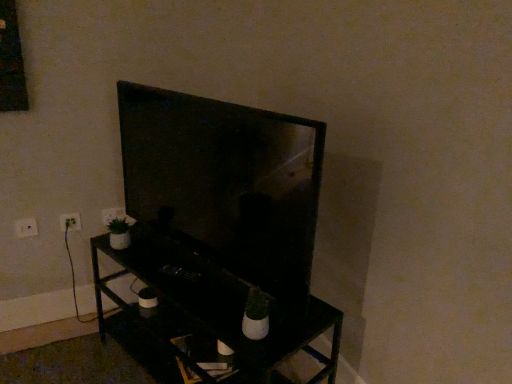
The image size is (512, 384). In order to click on white plastic electric outlet at left, positioned as the second electric outlet in right-to-left order in this screenshot , I will do click(70, 221).

What do you see at coordinates (70, 221) in the screenshot? I see `white plastic electric outlet at left, the 2th electric outlet positioned from the back` at bounding box center [70, 221].

Looking at this image, measure the distance between black matte tv stand at center and camera.

black matte tv stand at center is 1.15 meters from camera.

What is the approximate height of white plastic electric outlet at lower left, the 3th electric outlet positioned from the front?

The height of white plastic electric outlet at lower left, the 3th electric outlet positioned from the front, is 3.59 inches.

This screenshot has height=384, width=512. In order to click on white plastic electric outlet at left, which is the second electric outlet from front to back in this screenshot , I will do `click(70, 221)`.

From a real-world perspective, between matte black tv at center and black matte tv stand at center, who is vertically higher?

matte black tv at center.

At what (x,y) coordinates should I click in order to perform the action: click on furniture beneath the matte black tv at center (from a real-world perspective). Please return your answer as a coordinate pair (x, y). The width and height of the screenshot is (512, 384). Looking at the image, I should click on (204, 313).

Which of these two, matte black tv at center or black matte tv stand at center, is smaller?

matte black tv at center.

Is matte black tv at center in contact with black matte tv stand at center?

matte black tv at center and black matte tv stand at center are clearly separated.

From a real-world perspective, between matte black tv at center and white plastic electric outlet at left, positioned as the 2th electric outlet in left-to-right order, who is vertically lower?

white plastic electric outlet at left, positioned as the 2th electric outlet in left-to-right order, is physically lower.

Is matte black tv at center placed right next to white plastic electric outlet at left, the 2th electric outlet positioned from the back?

No, matte black tv at center is not next to white plastic electric outlet at left, the 2th electric outlet positioned from the back.

Considering the sizes of objects matte black tv at center and white plastic electric outlet at left, positioned as the 2th electric outlet in left-to-right order, in the image provided, who is wider, matte black tv at center or white plastic electric outlet at left, positioned as the 2th electric outlet in left-to-right order,?

Wider between the two is matte black tv at center.

Does point (253, 146) lie in front of point (76, 217)?

That is True.

Considering their positions, is white plastic electric outlet at lower left, the third electric outlet when ordered from left to right, located in front of or behind white plastic electric outlet at left, which is the second electric outlet from front to back?

Clearly, white plastic electric outlet at lower left, the third electric outlet when ordered from left to right, is behind white plastic electric outlet at left, which is the second electric outlet from front to back.

Based on the photo, are white plastic electric outlet at lower left, the 3th electric outlet positioned from the front, and white plastic electric outlet at left, the 2th electric outlet positioned from the back, making contact?

No, white plastic electric outlet at lower left, the 3th electric outlet positioned from the front, is not touching white plastic electric outlet at left, the 2th electric outlet positioned from the back.

From a real-world perspective, between white plastic electric outlet at lower left, which ranks as the first electric outlet in right-to-left order, and white plastic electric outlet at left, the 2th electric outlet positioned from the back, who is vertically higher?

white plastic electric outlet at lower left, which ranks as the first electric outlet in right-to-left order.

Does white plastic electric outlet at lower left, marked as the first electric outlet in a back-to-front arrangement, have a lesser height compared to white plastic electric outlet at left, which is the second electric outlet from front to back?

No.

Which object is positioned more to the left, black matte tv stand at center or white plastic electric outlet at left, positioned as the 2th electric outlet in left-to-right order?

Positioned to the left is white plastic electric outlet at left, positioned as the 2th electric outlet in left-to-right order.

Which of these two, black matte tv stand at center or white plastic electric outlet at left, the 2th electric outlet positioned from the back, is wider?

Wider between the two is black matte tv stand at center.

From a real-world perspective, which object rests below the other?

In real-world perspective, black matte tv stand at center is lower.

Does black matte tv stand at center have a greater height compared to white plastic electric outlet at left, the 2th electric outlet positioned from the back?

Yes.

From the picture: Between white plastic electric outlet at left, which is the second electric outlet from front to back, and black matte tv stand at center, which one has larger width?

Wider between the two is black matte tv stand at center.

Is the position of white plastic electric outlet at left, which is the second electric outlet from front to back, more distant than that of black matte tv stand at center?

Yes, it is.

Is black matte tv stand at center completely or partially inside white plastic electric outlet at left, positioned as the 2th electric outlet in left-to-right order?

No, black matte tv stand at center is not a part of white plastic electric outlet at left, positioned as the 2th electric outlet in left-to-right order.

From a real-world perspective, who is located lower, white plastic electric outlet at left, which is the second electric outlet from front to back, or black matte tv stand at center?

black matte tv stand at center.

From a real-world perspective, is black matte tv stand at center on white plastic electric outlet at lower left, which ranks as the first electric outlet in right-to-left order?

Incorrect, from a real-world perspective, black matte tv stand at center is lower than white plastic electric outlet at lower left, which ranks as the first electric outlet in right-to-left order.

Locate an element on the screen. furniture on the right of white plastic electric outlet at lower left, which ranks as the first electric outlet in right-to-left order is located at coordinates (204, 313).

Which of these two, black matte tv stand at center or white plastic electric outlet at lower left, which ranks as the first electric outlet in right-to-left order, stands shorter?

With less height is white plastic electric outlet at lower left, which ranks as the first electric outlet in right-to-left order.

Is black matte tv stand at center facing towards white plastic electric outlet at lower left, the 3th electric outlet from the right?

No, black matte tv stand at center is not oriented towards white plastic electric outlet at lower left, the 3th electric outlet from the right.

Which is behind, point (216, 275) or point (27, 224)?

The point (27, 224) is farther.

Are black matte tv stand at center and white plastic electric outlet at lower left, the 3th electric outlet from the right, located far from each other?

No, black matte tv stand at center is not far from white plastic electric outlet at lower left, the 3th electric outlet from the right.

Locate an element on the screen. furniture behind the matte black tv at center is located at coordinates (204, 313).

From the image's perspective, which electric outlet is the 2nd one below the matte black tv at center? Please provide its 2D coordinates.

[(70, 221)]

Based on their spatial positions, is white plastic electric outlet at lower left, which is counted as the first electric outlet, starting from the left, or matte black tv at center closer to black matte tv stand at center?

The object closer to black matte tv stand at center is matte black tv at center.

When comparing their distances from matte black tv at center, does white plastic electric outlet at lower left, marked as the first electric outlet in a back-to-front arrangement, or black matte tv stand at center seem further?

white plastic electric outlet at lower left, marked as the first electric outlet in a back-to-front arrangement, lies further to matte black tv at center than the other object.

When comparing their distances from white plastic electric outlet at left, positioned as the 2th electric outlet in left-to-right order, does matte black tv at center or white plastic electric outlet at lower left, marked as the first electric outlet in a back-to-front arrangement, seem closer?

white plastic electric outlet at lower left, marked as the first electric outlet in a back-to-front arrangement, lies closer to white plastic electric outlet at left, positioned as the 2th electric outlet in left-to-right order, than the other object.

From the image, which object appears to be farther from matte black tv at center, white plastic electric outlet at left, which is the second electric outlet from front to back, or white plastic electric outlet at lower left, the 3th electric outlet from the right?

white plastic electric outlet at lower left, the 3th electric outlet from the right, is positioned further to the anchor matte black tv at center.

Based on their spatial positions, is white plastic electric outlet at lower left, which ranks as the first electric outlet in right-to-left order, or white plastic electric outlet at left, positioned as the second electric outlet in right-to-left order, closer to matte black tv at center?

Based on the image, white plastic electric outlet at lower left, which ranks as the first electric outlet in right-to-left order, appears to be nearer to matte black tv at center.

Based on their spatial positions, is white plastic electric outlet at lower left, the 3th electric outlet from the right, or black matte tv stand at center closer to matte black tv at center?

black matte tv stand at center lies closer to matte black tv at center than the other object.

Which object lies further to the anchor point black matte tv stand at center, matte black tv at center or white plastic electric outlet at lower left, marked as the first electric outlet in a back-to-front arrangement?

The object further to black matte tv stand at center is white plastic electric outlet at lower left, marked as the first electric outlet in a back-to-front arrangement.

From the picture: When comparing their distances from white plastic electric outlet at lower left, the 3th electric outlet from the right, does white plastic electric outlet at lower left, which ranks as the first electric outlet in right-to-left order, or black matte tv stand at center seem further?

Among the two, black matte tv stand at center is located further to white plastic electric outlet at lower left, the 3th electric outlet from the right.

I want to click on furniture located between matte black tv at center and white plastic electric outlet at left, positioned as the 2th electric outlet in left-to-right order, in the depth direction, so click(204, 313).

Where is `electric outlet located between matte black tv at center and white plastic electric outlet at left, the 2th electric outlet positioned from the back, in the depth direction`? This screenshot has width=512, height=384. electric outlet located between matte black tv at center and white plastic electric outlet at left, the 2th electric outlet positioned from the back, in the depth direction is located at coordinates (26, 227).

The width and height of the screenshot is (512, 384). I want to click on electric outlet situated between white plastic electric outlet at lower left, the 3th electric outlet from the right, and white plastic electric outlet at lower left, the third electric outlet when ordered from left to right, from left to right, so click(x=70, y=221).

Where is `furniture positioned between matte black tv at center and white plastic electric outlet at lower left, the 3th electric outlet from the right, from near to far`? furniture positioned between matte black tv at center and white plastic electric outlet at lower left, the 3th electric outlet from the right, from near to far is located at coordinates [204, 313].